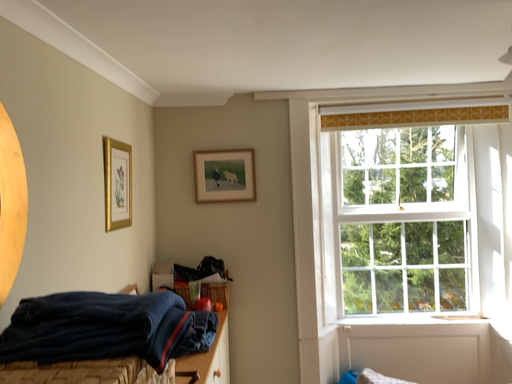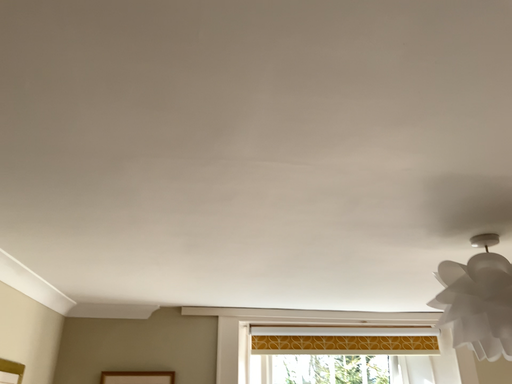
Question: Which way did the camera rotate in the video?

Choices:
 (A) rotated upward
 (B) rotated downward

Answer: (A)